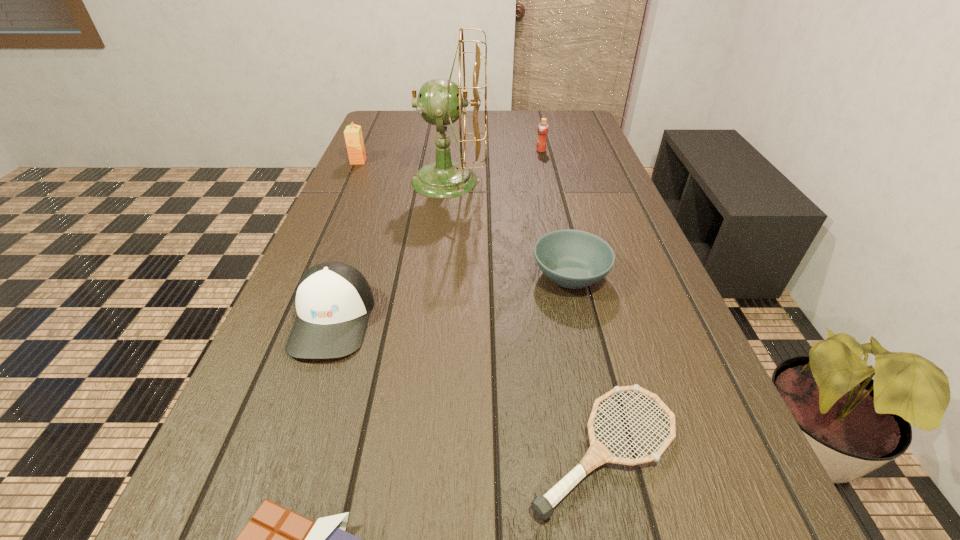
Locate an element on the screen. The image size is (960, 540). vacant position at the far right corner of the desktop is located at coordinates (552, 132).

This screenshot has height=540, width=960. Find the location of `free space that is in between the cap and the tennis racket`. free space that is in between the cap and the tennis racket is located at coordinates (468, 384).

This screenshot has width=960, height=540. I want to click on vacant space in between the tennis racket and the nearer orange juice, so click(x=481, y=306).

At what (x,y) coordinates should I click in order to perform the action: click on unoccupied area between the fan and the tennis racket. Please return your answer as a coordinate pair (x, y). This screenshot has height=540, width=960. Looking at the image, I should click on (526, 315).

I want to click on empty location between the nearer orange juice and the tennis racket, so click(481, 306).

The image size is (960, 540). I want to click on vacant space that's between the tennis racket and the nearer orange juice, so click(481, 306).

At what (x,y) coordinates should I click in order to perform the action: click on object that can be found as the closest to the left orange juice. Please return your answer as a coordinate pair (x, y). Looking at the image, I should click on (438, 104).

Find the location of a particular element. The image size is (960, 540). object that is the closest to the cap is located at coordinates [x=276, y=539].

At what (x,y) coordinates should I click in order to perform the action: click on free point that satisfies the following two spatial constraints: 1. in front of the tennis racket, directing air flow; 2. on the left side of the fan. Please return your answer as a coordinate pair (x, y). Looking at the image, I should click on point(420,450).

At what (x,y) coordinates should I click in order to perform the action: click on free space that satisfies the following two spatial constraints: 1. on the back side of the tennis racket; 2. on the left side of the farther orange juice. Please return your answer as a coordinate pair (x, y). The height and width of the screenshot is (540, 960). Looking at the image, I should click on (538, 151).